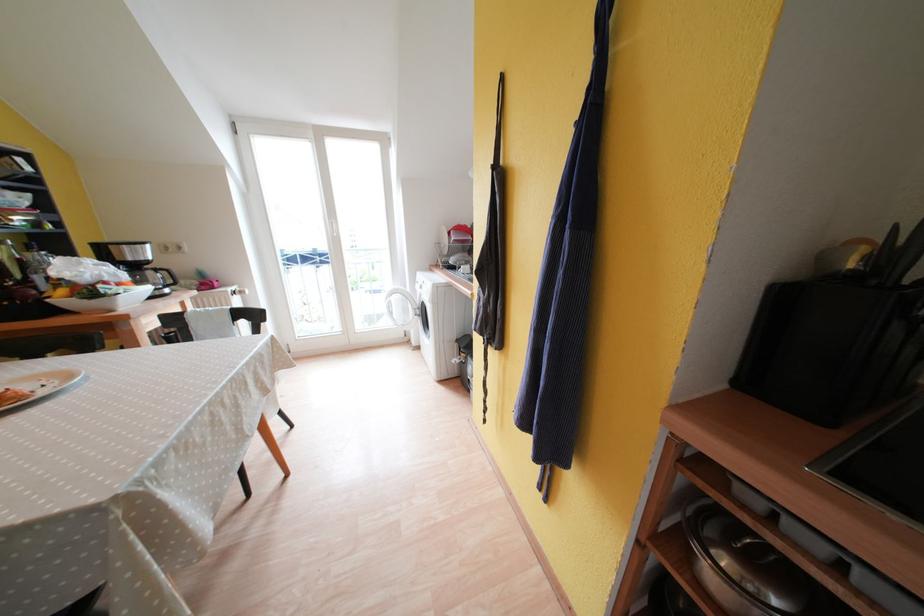
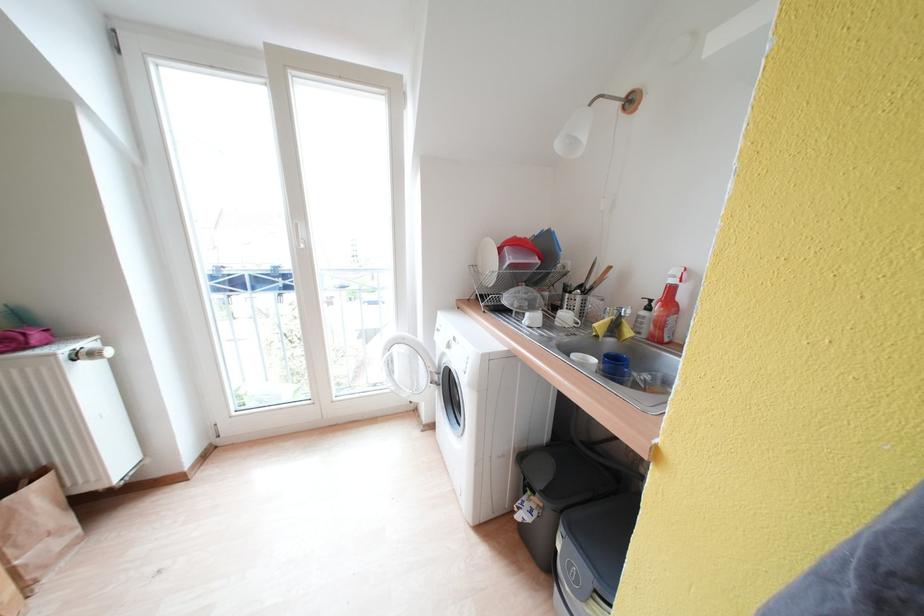
Find the pixel in the second image that matches point (397, 315) in the first image.

(397, 376)